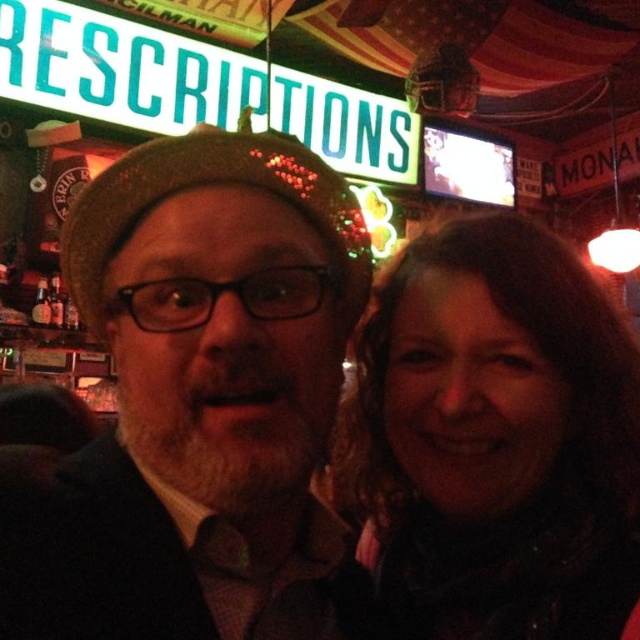
Question: Among these objects, which one is farthest from the camera?

Choices:
 (A) dark brown knit hat at center
 (B) dark brown hair at upper right

Answer: (B)

Question: Can you confirm if dark brown knit hat at center is positioned to the right of dark brown hair at upper right?

Choices:
 (A) yes
 (B) no

Answer: (B)

Question: Which point is farther to the camera?

Choices:
 (A) dark brown knit hat at center
 (B) dark brown hair at upper right

Answer: (B)

Question: Among these points, which one is farthest from the camera?

Choices:
 (A) (104, 545)
 (B) (520, 483)

Answer: (B)

Question: Can you confirm if dark brown knit hat at center is thinner than dark brown hair at upper right?

Choices:
 (A) yes
 (B) no

Answer: (B)

Question: Does dark brown knit hat at center have a lesser width compared to dark brown hair at upper right?

Choices:
 (A) no
 (B) yes

Answer: (A)